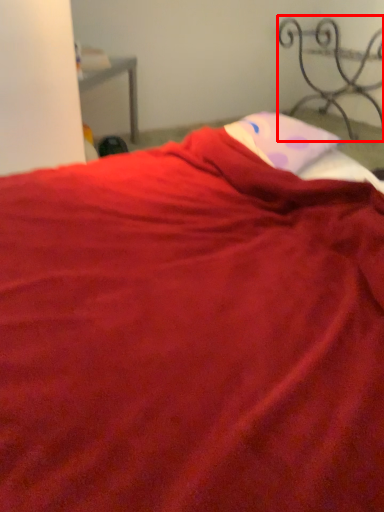
Question: From the image's perspective, what is the correct spatial relationship of furniture (annotated by the red box) in relation to pillow?

Choices:
 (A) below
 (B) above

Answer: (B)